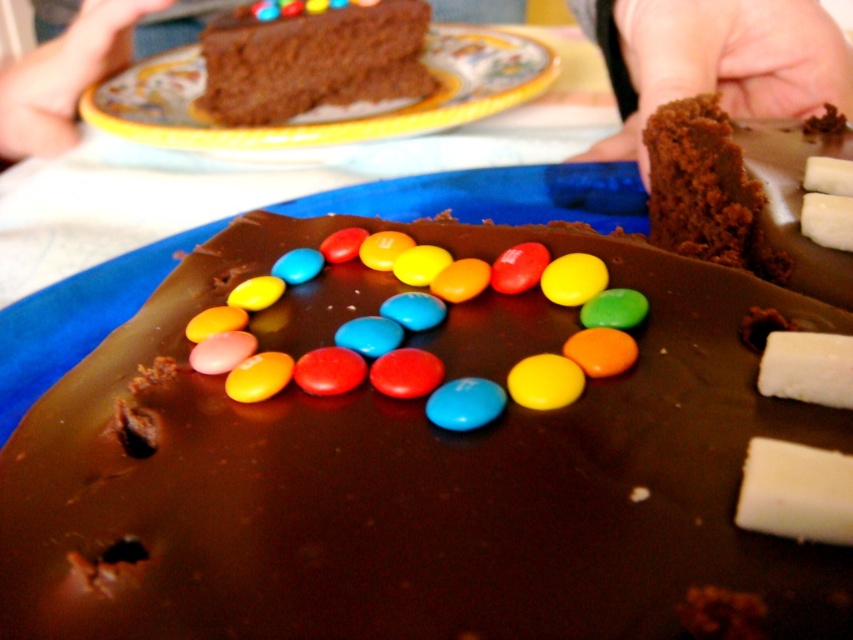
Question: Which object is farther from the camera taking this photo?

Choices:
 (A) brown crumbly cake at upper right
 (B) blue glossy m&m at center

Answer: (A)

Question: Which point is closer to the camera taking this photo?

Choices:
 (A) (666, 129)
 (B) (633, 67)

Answer: (A)

Question: Is shiny chocolate candies at center to the left of chocolate cake at upper center from the viewer's perspective?

Choices:
 (A) no
 (B) yes

Answer: (A)

Question: Is shiny chocolate candies at center above matte chocolate cake at upper center?

Choices:
 (A) no
 (B) yes

Answer: (A)

Question: Can you confirm if matte chocolate cake at upper center is wider than blue glossy m&m at center?

Choices:
 (A) yes
 (B) no

Answer: (A)

Question: Which object appears closest to the camera in this image?

Choices:
 (A) blue glossy m&m at center
 (B) brown crumbly cake at upper right
 (C) chocolatecrumblycake at right

Answer: (A)